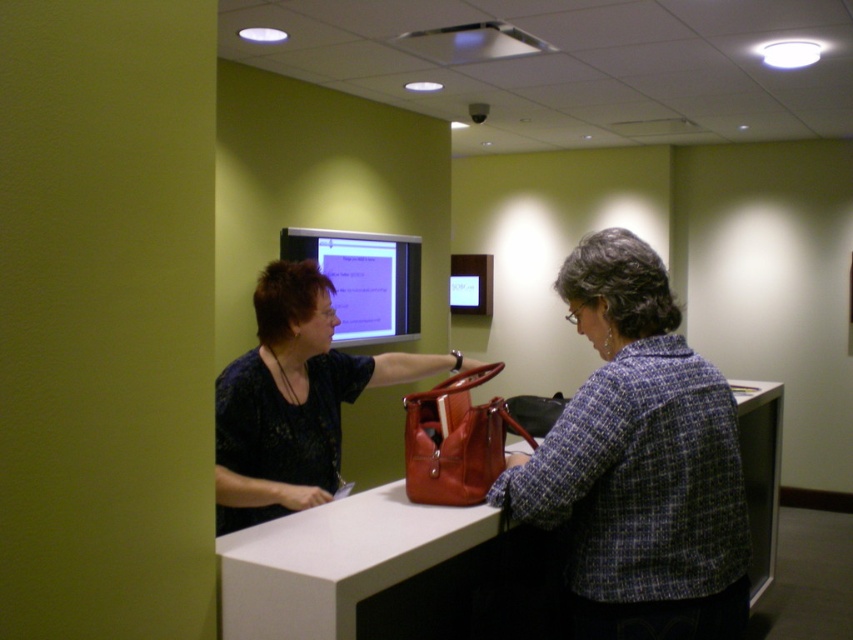
Question: Which point is farther from the camera taking this photo?

Choices:
 (A) (770, 548)
 (B) (230, 468)
 (C) (415, 321)

Answer: (C)

Question: Which of the following is the farthest from the observer?

Choices:
 (A) leather handbag at center
 (B) matte black blouse at center
 (C) matte plastic monitor at center

Answer: (C)

Question: Which point appears farthest from the camera in this image?

Choices:
 (A) (514, 548)
 (B) (311, 236)
 (C) (732, 608)

Answer: (B)

Question: Is matte black blouse at center below matte plastic monitor at center?

Choices:
 (A) yes
 (B) no

Answer: (A)

Question: Can you confirm if plaid wool jacket at center is positioned below matte black blouse at center?

Choices:
 (A) no
 (B) yes

Answer: (B)

Question: Is plaid wool jacket at center thinner than matte plastic monitor at center?

Choices:
 (A) yes
 (B) no

Answer: (A)